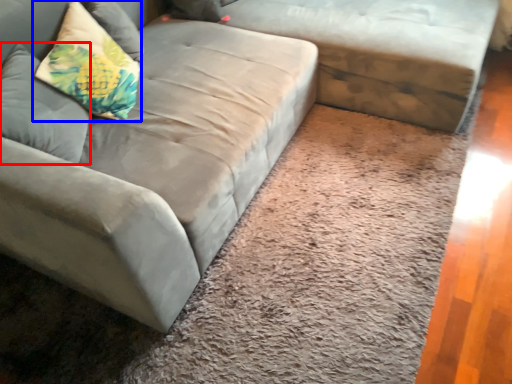
Question: Which object is further to the camera taking this photo, pillow (highlighted by a red box) or pillow (highlighted by a blue box)?

Choices:
 (A) pillow
 (B) pillow

Answer: (B)